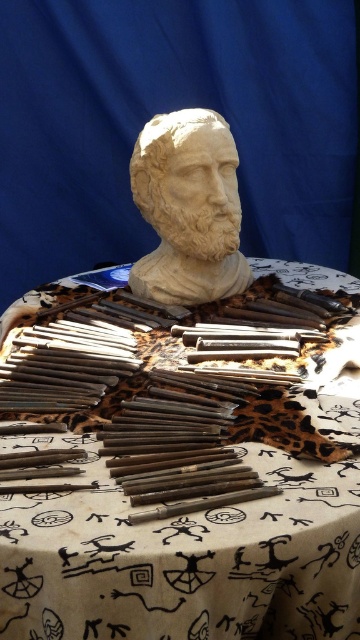
You are an art conservator inspecting a sculpture display. You need to place a protective cloth over the matte stone bust at center. Can you place the brown wood table at center on top of the bust?

The brown wood table at center is located below the matte stone bust at center, so you cannot place the table on top of the bust since it is already positioned underneath it.

You are standing in front of the sculpted bust and want to place two markers at the specified coordinates on the table. The first marker is at point (x=168, y=625) and the second at point (x=169, y=154). Which marker will be closer to the sculpture?

Point (x=168, y=625) is in front of point (x=169, y=154), so the marker at point (x=168, y=625) will be closer to the sculpture.